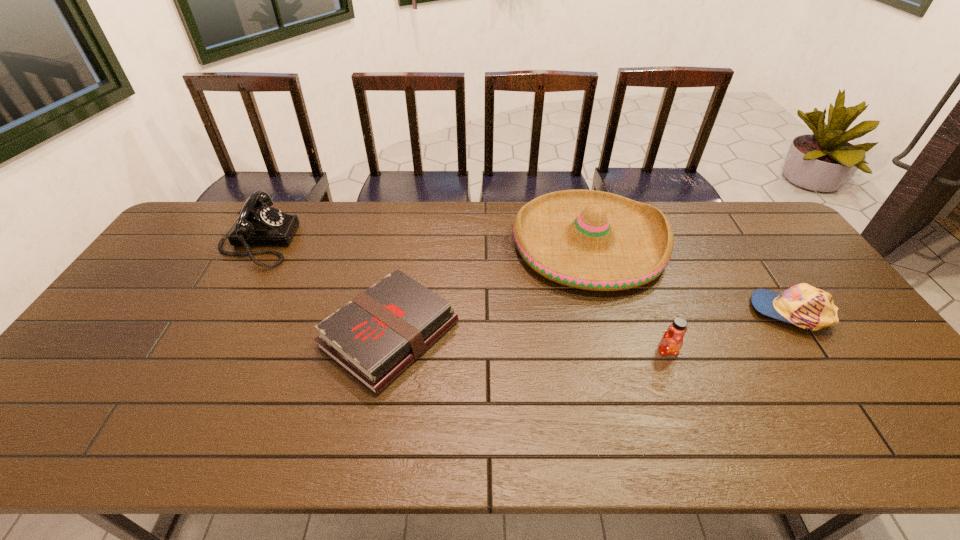
Where is `vacant space at the far left corner of the desktop`? vacant space at the far left corner of the desktop is located at coordinates (222, 208).

What are the coordinates of `vacant point at the far right corner` in the screenshot? It's located at (762, 232).

I want to click on empty space that is in between the sombrero and the telephone, so click(x=423, y=243).

Locate an element on the screen. The image size is (960, 540). vacant area that lies between the hardback book and the sombrero is located at coordinates (490, 289).

In order to click on free spot between the honey and the rightmost object in this screenshot , I will do pyautogui.click(x=730, y=331).

Find the location of `blank region between the honey and the sombrero`. blank region between the honey and the sombrero is located at coordinates [x=628, y=298].

Where is `vacant region between the third shortest object and the sombrero`? The width and height of the screenshot is (960, 540). vacant region between the third shortest object and the sombrero is located at coordinates (628, 298).

Where is `free space between the sombrero and the honey`? free space between the sombrero and the honey is located at coordinates (628, 298).

The height and width of the screenshot is (540, 960). In order to click on free space between the third tallest object and the telephone in this screenshot , I will do [463, 296].

Find the location of a particular element. free area in between the honey and the sombrero is located at coordinates [628, 298].